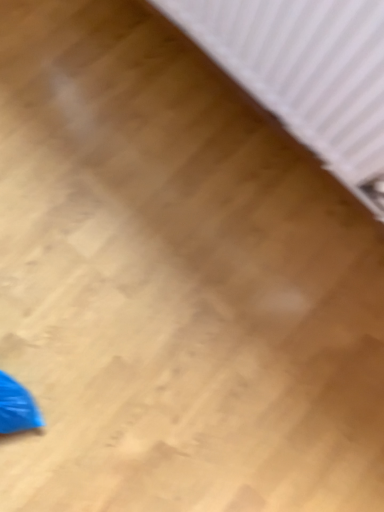
I want to click on vacant area situated below white textured radiator at upper right (from a real-world perspective), so click(256, 126).